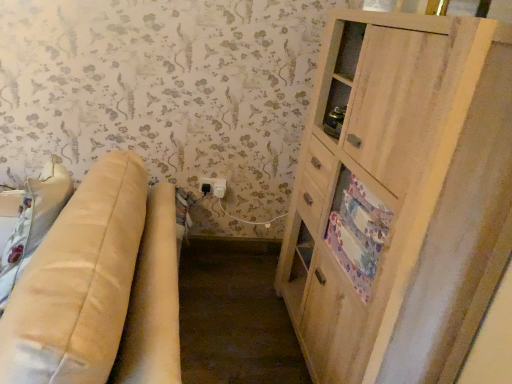
Question: In the image, is floral fabric drawer at right positioned in front of or behind beige leather couch at left?

Choices:
 (A) behind
 (B) front

Answer: (A)

Question: From the image's perspective, is floral fabric drawer at right above or below beige leather couch at left?

Choices:
 (A) below
 (B) above

Answer: (B)

Question: Estimate the real-world distances between objects in this image. Which object is farther from the light wood cabinet at right?

Choices:
 (A) beige leather couch at left
 (B) black plastic electric outlet at lower center
 (C) floral fabric drawer at right

Answer: (B)

Question: Which object is positioned closest to the black plastic electric outlet at lower center?

Choices:
 (A) floral fabric drawer at right
 (B) light wood cabinet at right
 (C) beige leather couch at left

Answer: (A)